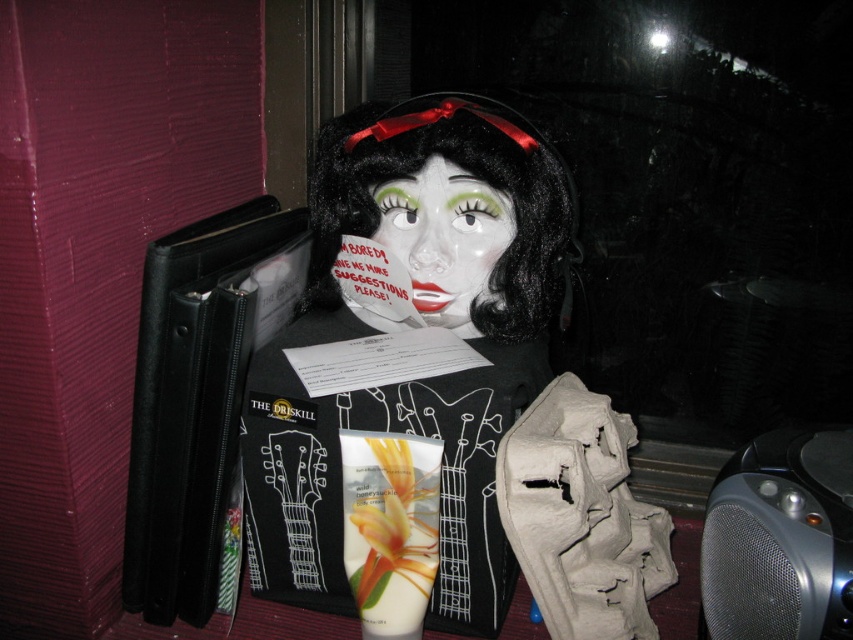
Question: Which point is farther from the camera taking this photo?

Choices:
 (A) (390, 630)
 (B) (817, 630)
 (C) (469, 326)

Answer: (C)

Question: Which of these objects is positioned closest to the matte black doll at center?

Choices:
 (A) black velvet wig at center
 (B) porcelain face at center
 (C) silver mesh speaker at lower right

Answer: (A)

Question: Does matte black doll at center have a greater width compared to silver mesh speaker at lower right?

Choices:
 (A) no
 (B) yes

Answer: (B)

Question: Is silver mesh speaker at lower right wider than porcelain face at center?

Choices:
 (A) no
 (B) yes

Answer: (B)

Question: Is silver mesh speaker at lower right bigger than porcelain face at center?

Choices:
 (A) yes
 (B) no

Answer: (A)

Question: Which object appears farthest from the camera in this image?

Choices:
 (A) silver mesh speaker at lower right
 (B) matte black doll at center

Answer: (B)